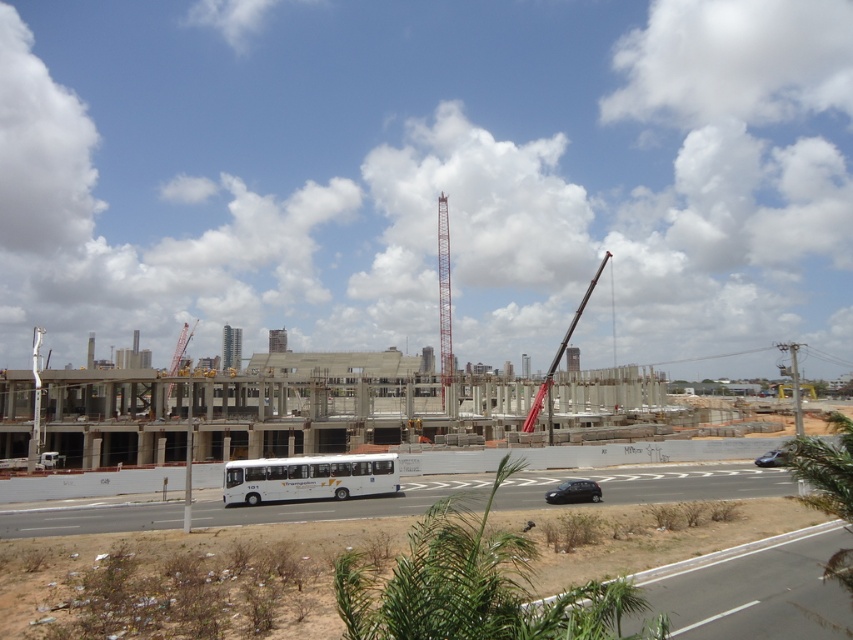
Question: Can you confirm if red metallic crane at center is wider than shiny black sedan at lower right?

Choices:
 (A) yes
 (B) no

Answer: (B)

Question: From the image, what is the correct spatial relationship of white concrete highway at lower center in relation to red painted metal tower crane at center?

Choices:
 (A) below
 (B) above

Answer: (A)

Question: Estimate the real-world distances between objects in this image. Which object is farther from the shiny black sedan at lower right?

Choices:
 (A) black matte car at lower center
 (B) red painted metal tower crane at center
 (C) white matte bus at center

Answer: (B)

Question: Observing the image, what is the correct spatial positioning of white matte bus at center in reference to red metallic crane at center?

Choices:
 (A) left
 (B) right

Answer: (A)

Question: Which point is closer to the camera taking this photo?

Choices:
 (A) (447, 269)
 (B) (344, 484)
 (C) (560, 356)

Answer: (B)

Question: Which of the following is the closest to the observer?

Choices:
 (A) white matte bus at center
 (B) white concrete highway at lower center
 (C) shiny black sedan at lower right
 (D) red metallic crane at center

Answer: (C)